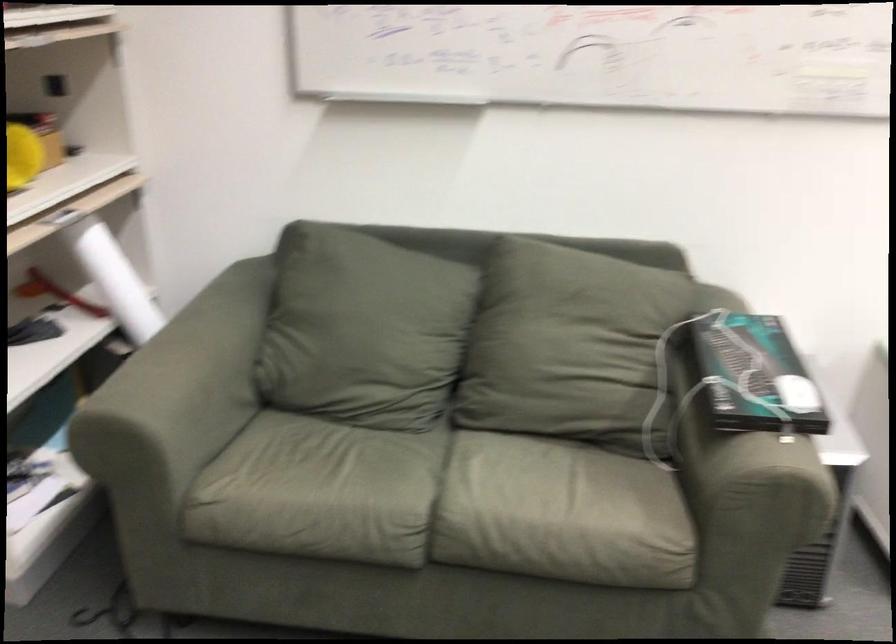
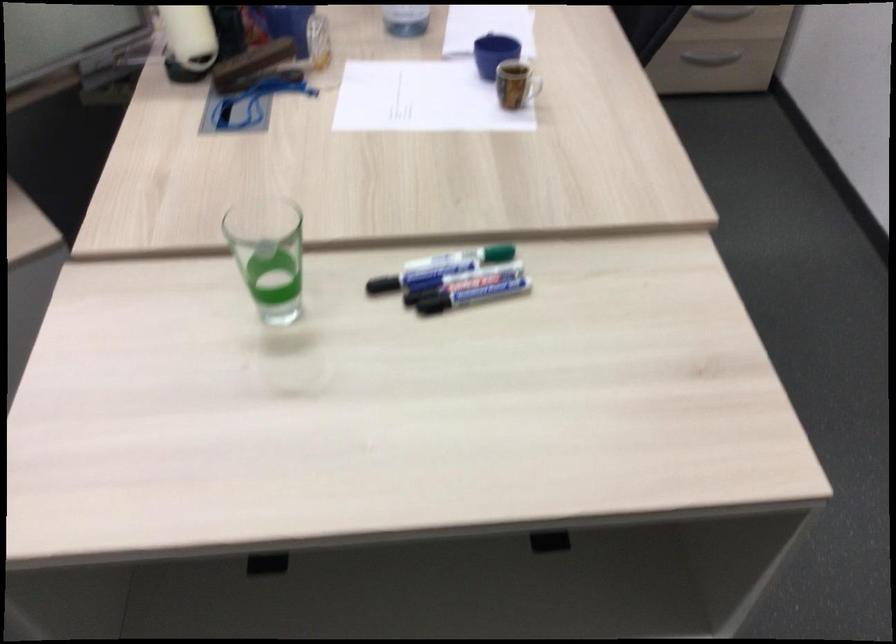
Based on the continuous images, in which direction is the camera rotating?

The rotation direction of the camera is right-down.